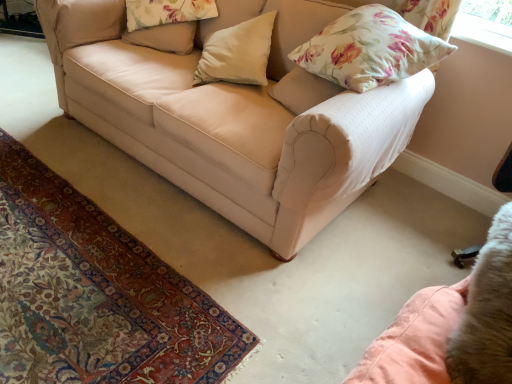
Question: Is beige fabric couch at center aimed at floral fabric pillow at upper right, which is the first pillow in right-to-left order?

Choices:
 (A) no
 (B) yes

Answer: (A)

Question: Can you confirm if beige fabric couch at center is positioned to the left of floral fabric pillow at upper right, the third pillow from the left?

Choices:
 (A) no
 (B) yes

Answer: (B)

Question: Is beige fabric couch at center not within floral fabric pillow at upper right, the third pillow from the left?

Choices:
 (A) no
 (B) yes

Answer: (B)

Question: Is beige fabric couch at center positioned with its back to floral fabric pillow at upper right, which is the first pillow in right-to-left order?

Choices:
 (A) no
 (B) yes

Answer: (A)

Question: Would you say floral fabric pillow at upper right, which is the first pillow in right-to-left order, is part of beige fabric couch at center's contents?

Choices:
 (A) no
 (B) yes

Answer: (B)

Question: In the image, is metallic silver swivel chair at lower right positioned in front of or behind white matte pillow at center, the 2th pillow from the right?

Choices:
 (A) front
 (B) behind

Answer: (A)

Question: Would you say metallic silver swivel chair at lower right is inside or outside white matte pillow at center, marked as the second pillow in a left-to-right arrangement?

Choices:
 (A) outside
 (B) inside

Answer: (A)

Question: Based on their sizes in the image, would you say metallic silver swivel chair at lower right is bigger or smaller than white matte pillow at center, the 2th pillow from the right?

Choices:
 (A) small
 (B) big

Answer: (A)

Question: Considering the positions of point (501, 221) and point (208, 49), is point (501, 221) closer or farther from the camera than point (208, 49)?

Choices:
 (A) closer
 (B) farther

Answer: (A)

Question: In terms of size, does beige fabric pillow at upper center, which ranks as the 1th pillow in left-to-right order, appear bigger or smaller than beige fabric couch at center?

Choices:
 (A) big
 (B) small

Answer: (B)

Question: From the image's perspective, is beige fabric pillow at upper center, positioned as the 3th pillow in right-to-left order, positioned above or below beige fabric couch at center?

Choices:
 (A) above
 (B) below

Answer: (A)

Question: Is point (159, 29) positioned closer to the camera than point (226, 122)?

Choices:
 (A) closer
 (B) farther

Answer: (B)

Question: From a real-world perspective, is beige fabric pillow at upper center, positioned as the 3th pillow in right-to-left order, above or below beige fabric couch at center?

Choices:
 (A) above
 (B) below

Answer: (A)

Question: From a real-world perspective, is floral fabric pillow at upper right, which is the first pillow in right-to-left order, positioned above or below beige fabric pillow at upper center, positioned as the 3th pillow in right-to-left order?

Choices:
 (A) above
 (B) below

Answer: (A)

Question: Is point (318, 51) positioned closer to the camera than point (182, 46)?

Choices:
 (A) farther
 (B) closer

Answer: (B)